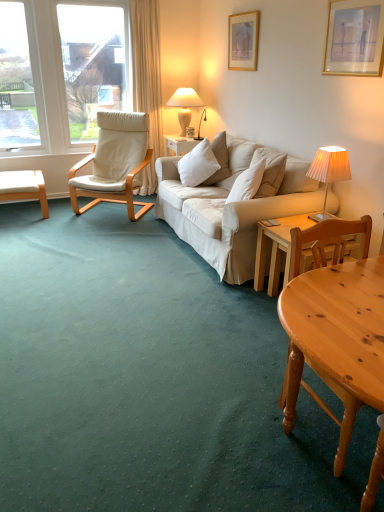
The width and height of the screenshot is (384, 512). I want to click on free space to the left of light wood desk at lower right, which is the 2th desk in left-to-right order, so click(240, 302).